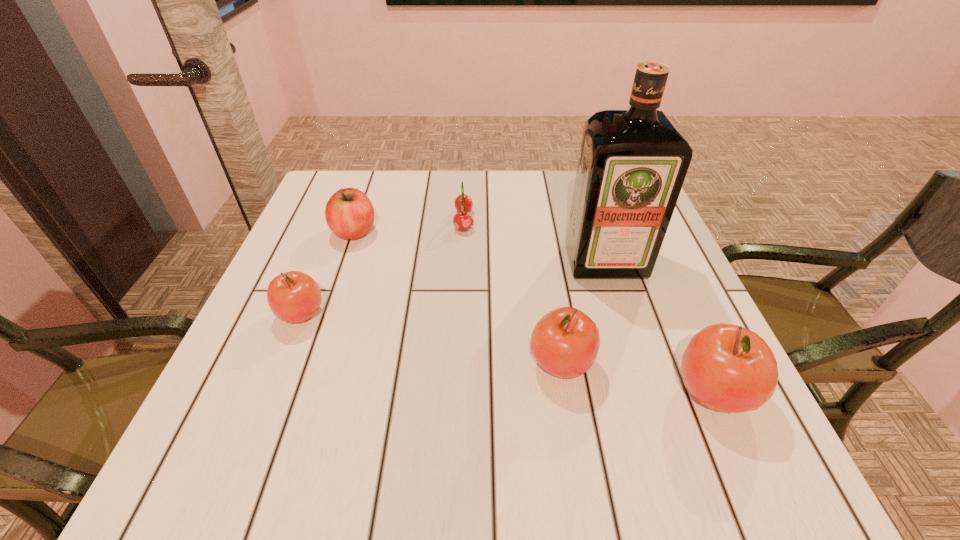
The image size is (960, 540). In the image, there is a desktop. Identify the location of vacant space at the left edge. (269, 364).

Image resolution: width=960 pixels, height=540 pixels. In the image, there is a desktop. Find the location of `free space at the right edge`. free space at the right edge is located at coordinates (682, 340).

The height and width of the screenshot is (540, 960). In order to click on free space at the near left corner of the desktop in this screenshot , I will do `click(235, 406)`.

In the image, there is a desktop. Where is `vacant space at the near right corner`? The height and width of the screenshot is (540, 960). vacant space at the near right corner is located at coordinates (690, 418).

I want to click on vacant area that lies between the third tallest object and the farthest apple, so click(x=458, y=298).

This screenshot has width=960, height=540. I want to click on vacant area that lies between the farthest apple and the rightmost apple, so click(534, 312).

Where is `free space between the second apple from right to left and the third nearest object`? The height and width of the screenshot is (540, 960). free space between the second apple from right to left and the third nearest object is located at coordinates (431, 339).

Find the location of a particular element. The image size is (960, 540). free space between the third nearest apple and the rightmost apple is located at coordinates (507, 353).

Identify the location of free space between the farthest apple and the second tallest apple. This screenshot has width=960, height=540. [458, 298].

In order to click on free space between the liquor and the fourth farthest object in this screenshot , I will do `click(453, 287)`.